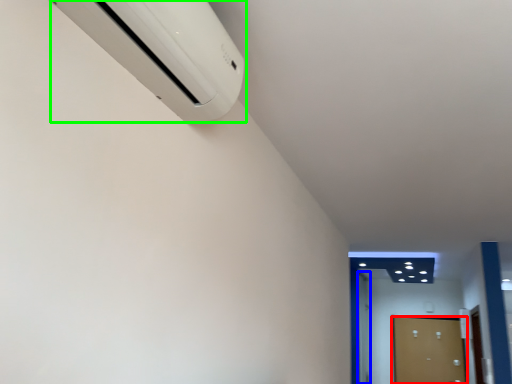
Question: Which is nearer to the door (highlighted by a red box)? door (highlighted by a blue box) or home appliance (highlighted by a green box).

Choices:
 (A) door
 (B) home appliance

Answer: (A)